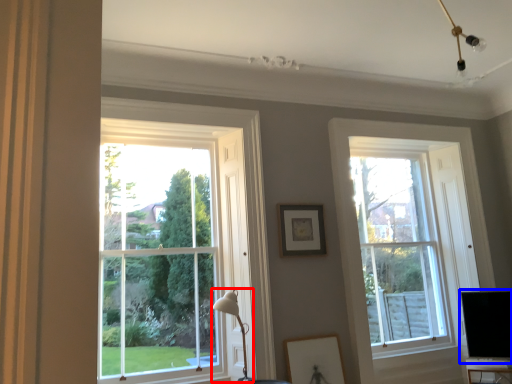
Question: Which of the following is the closest to the observer, table lamp (highlighted by a red box) or computer monitor (highlighted by a blue box)?

Choices:
 (A) table lamp
 (B) computer monitor

Answer: (A)